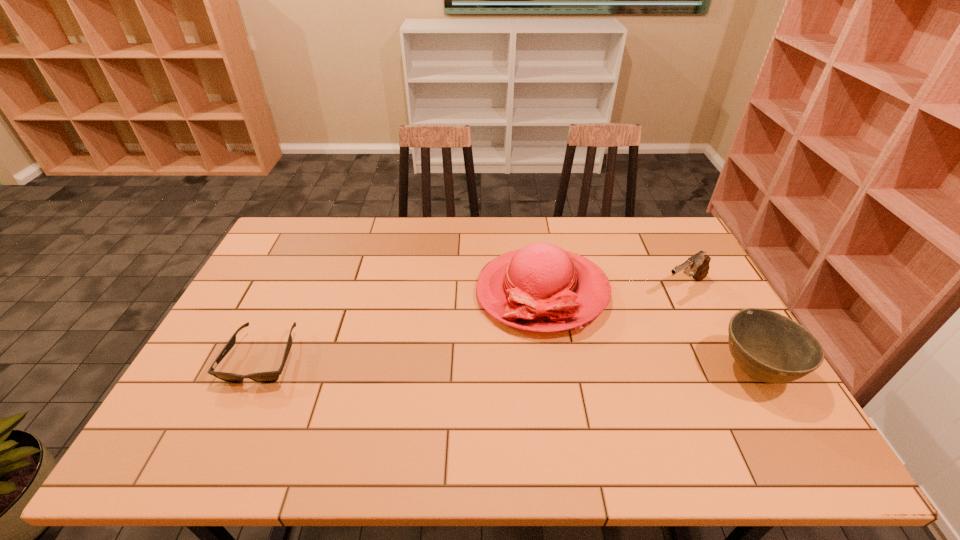
Identify the location of object situated at the near right corner. (769, 347).

This screenshot has width=960, height=540. In the image, there is a desktop. Find the location of `vacant space at the far edge`. vacant space at the far edge is located at coordinates (417, 238).

Locate an element on the screen. This screenshot has width=960, height=540. vacant space at the near edge of the desktop is located at coordinates (616, 413).

At what (x,y) coordinates should I click in order to perform the action: click on vacant space at the left edge of the desktop. Please return your answer as a coordinate pair (x, y). Looking at the image, I should click on (260, 331).

This screenshot has width=960, height=540. I want to click on vacant point at the right edge, so (718, 321).

In the image, there is a desktop. At what (x,y) coordinates should I click in order to perform the action: click on vacant space at the far left corner. Please return your answer as a coordinate pair (x, y). Looking at the image, I should click on (325, 230).

Find the location of a particular element. free space at the near left corner of the desktop is located at coordinates (205, 411).

Find the location of `vacant area that lies between the hat and the bowl`. vacant area that lies between the hat and the bowl is located at coordinates (648, 332).

Where is `vacant region between the shortest object and the pistol`? The height and width of the screenshot is (540, 960). vacant region between the shortest object and the pistol is located at coordinates (473, 322).

I want to click on free space that is in between the pistol and the shortest object, so click(x=473, y=322).